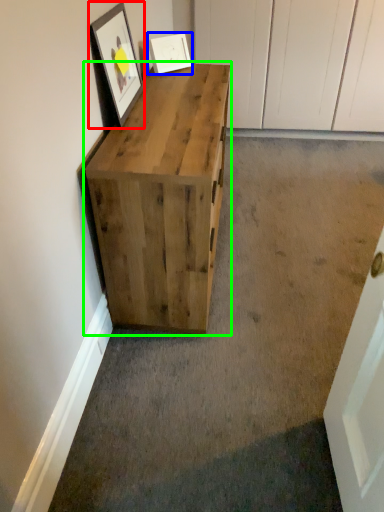
Question: Estimate the real-world distances between objects in this image. Which object is farther from picture frame (highlighted by a red box), picture frame (highlighted by a blue box) or chest of drawers (highlighted by a green box)?

Choices:
 (A) picture frame
 (B) chest of drawers

Answer: (A)